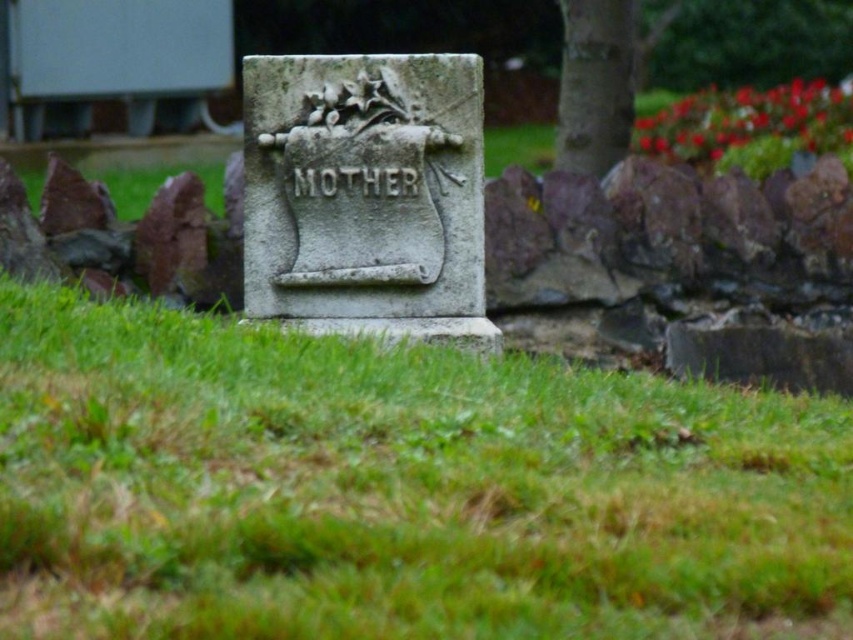
You are standing in a memorial garden and see the green grass at center and the smooth bark tree at upper right. Which object is positioned to the left of the other?

The green grass at center is to the left of the smooth bark tree at upper right.